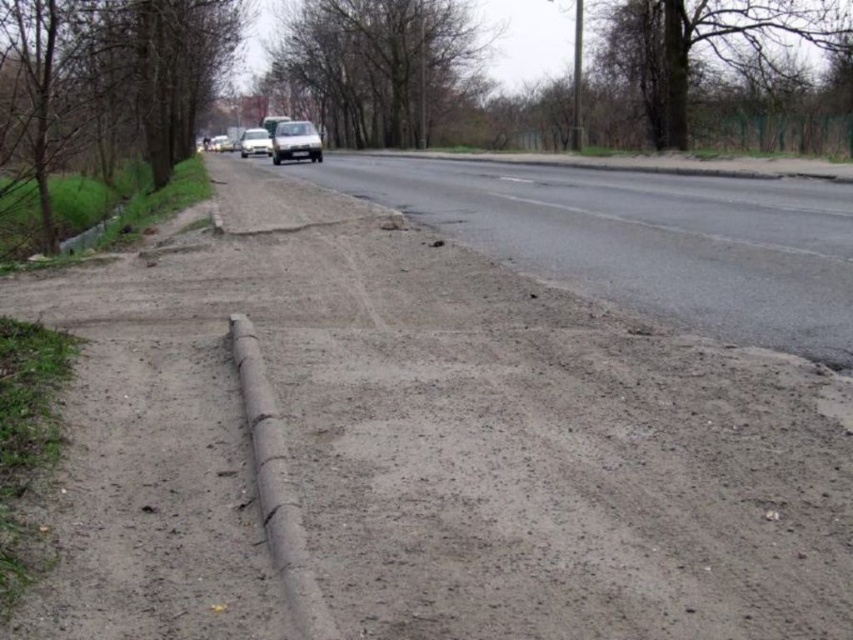
You are a delivery driver who needs to park your white matte car at center and matte black car at center side by side in a narrow alley. Given the space available, which car should you park first to ensure both can fit without overlapping?

The white matte car at center is wider than the matte black car at center. To park them side by side in the narrow alley, you should park the narrower matte black car at center first, leaving enough space for the wider white matte car at center next to it.

You are driving a car that is 1.5 meters long and want to park between the white matte car at center and the matte black car at center. Is there enough space between them to fit your car?

The white matte car at center is 1.56 meters from the matte black car at center. Since your car is 1.5 meters long, there is enough space to fit your car between them.

You are a driver approaching the road and see the satin silver sedan at center and the matte black car at center. Which car should you be cautious of overtaking due to its size?

The satin silver sedan at center is larger in size than the matte black car at center, so you should be cautious of overtaking the satin silver sedan at center because of its greater size.